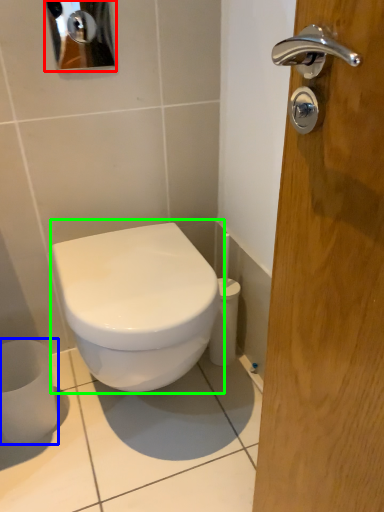
Question: Which is nearer to the mirror (highlighted by a red box)? toilet paper (highlighted by a blue box) or toilet (highlighted by a green box).

Choices:
 (A) toilet paper
 (B) toilet

Answer: (B)